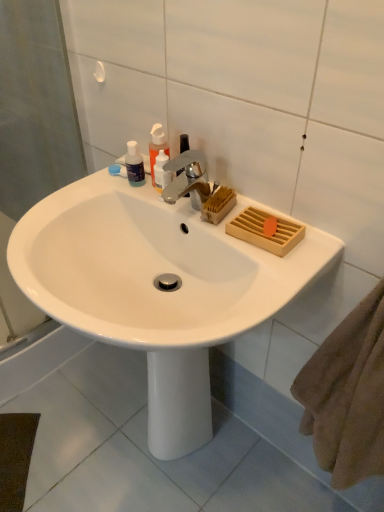
I want to click on blank space to the left of translucent plastic bottles at upper left, the first toiletry when ordered from right to left, so click(89, 196).